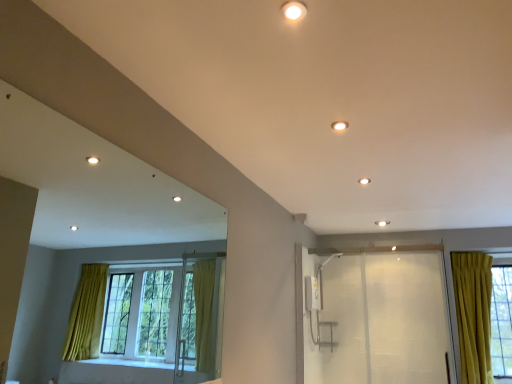
Question: Are matte white light fixture at upper center, marked as the 2th lighting in a left-to-right arrangement, and transparent plastic screen door at right making contact?

Choices:
 (A) yes
 (B) no

Answer: (B)

Question: Does matte white light fixture at upper center, the first lighting from the right, turn towards transparent plastic screen door at right?

Choices:
 (A) no
 (B) yes

Answer: (A)

Question: From the image's perspective, is matte white light fixture at upper center, the second lighting in the top-to-bottom sequence, located above transparent plastic screen door at right?

Choices:
 (A) yes
 (B) no

Answer: (A)

Question: Does matte white light fixture at upper center, marked as the 2th lighting in a left-to-right arrangement, have a greater height compared to transparent plastic screen door at right?

Choices:
 (A) yes
 (B) no

Answer: (B)

Question: Considering the relative positions of matte white light fixture at upper center, which appears as the 1th lighting when ordered from the bottom, and transparent plastic screen door at right in the image provided, is matte white light fixture at upper center, which appears as the 1th lighting when ordered from the bottom, behind transparent plastic screen door at right?

Choices:
 (A) yes
 (B) no

Answer: (B)

Question: Looking at their shapes, would you say transparent plastic screen door at right is wider or thinner than matte white light fixture at upper center, marked as the first lighting in a top-to-bottom arrangement?

Choices:
 (A) thin
 (B) wide

Answer: (A)

Question: Based on their sizes in the image, would you say transparent plastic screen door at right is bigger or smaller than matte white light fixture at upper center, the 1th lighting when ordered from front to back?

Choices:
 (A) big
 (B) small

Answer: (A)

Question: Is transparent plastic screen door at right in front of or behind matte white light fixture at upper center, the 2th lighting when ordered from bottom to top, in the image?

Choices:
 (A) behind
 (B) front

Answer: (A)

Question: Considering the relative positions of transparent plastic screen door at right and matte white light fixture at upper center, placed as the 1th lighting when sorted from left to right, in the image provided, is transparent plastic screen door at right to the left or to the right of matte white light fixture at upper center, placed as the 1th lighting when sorted from left to right,?

Choices:
 (A) right
 (B) left

Answer: (A)

Question: In terms of size, does matte white light fixture at upper center, which appears as the 1th lighting when ordered from the bottom, appear bigger or smaller than matte white light fixture at upper center, placed as the 1th lighting when sorted from left to right?

Choices:
 (A) big
 (B) small

Answer: (A)

Question: Considering the relative positions of matte white light fixture at upper center, the first lighting from the right, and matte white light fixture at upper center, marked as the first lighting in a top-to-bottom arrangement, in the image provided, is matte white light fixture at upper center, the first lighting from the right, to the left or to the right of matte white light fixture at upper center, marked as the first lighting in a top-to-bottom arrangement,?

Choices:
 (A) right
 (B) left

Answer: (A)

Question: From a real-world perspective, is matte white light fixture at upper center, which appears as the 1th lighting when ordered from the bottom, positioned above or below matte white light fixture at upper center, the 2th lighting when ordered from bottom to top?

Choices:
 (A) above
 (B) below

Answer: (A)

Question: In terms of width, does matte white light fixture at upper center, the second lighting in the top-to-bottom sequence, look wider or thinner when compared to matte white light fixture at upper center, which is counted as the 2th lighting, starting from the right?

Choices:
 (A) wide
 (B) thin

Answer: (B)

Question: Is transparent plastic screen door at right taller or shorter than matte white light fixture at upper center, the second lighting in the top-to-bottom sequence?

Choices:
 (A) short
 (B) tall

Answer: (B)

Question: Is transparent plastic screen door at right wider or thinner than matte white light fixture at upper center, which is counted as the 2th lighting, starting from the front?

Choices:
 (A) thin
 (B) wide

Answer: (A)